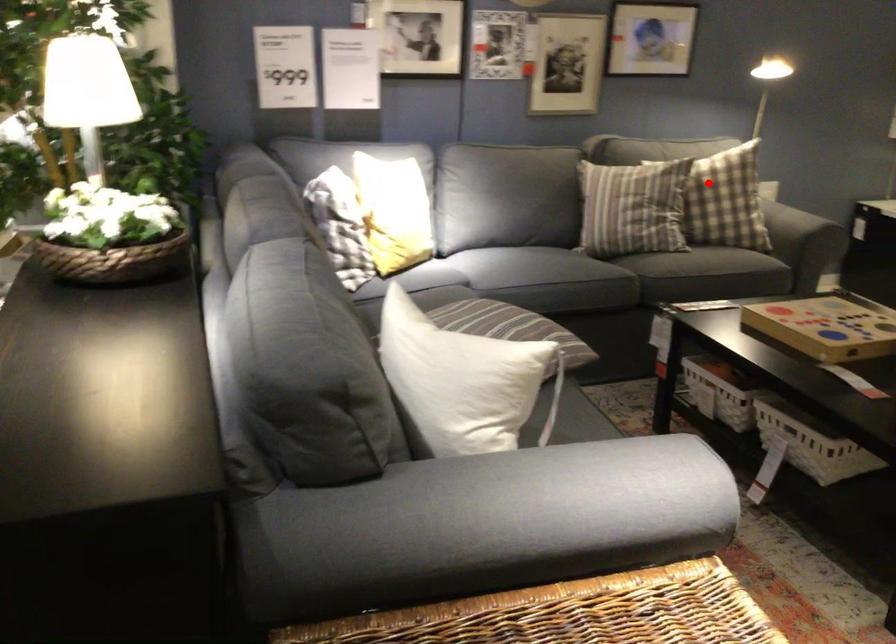
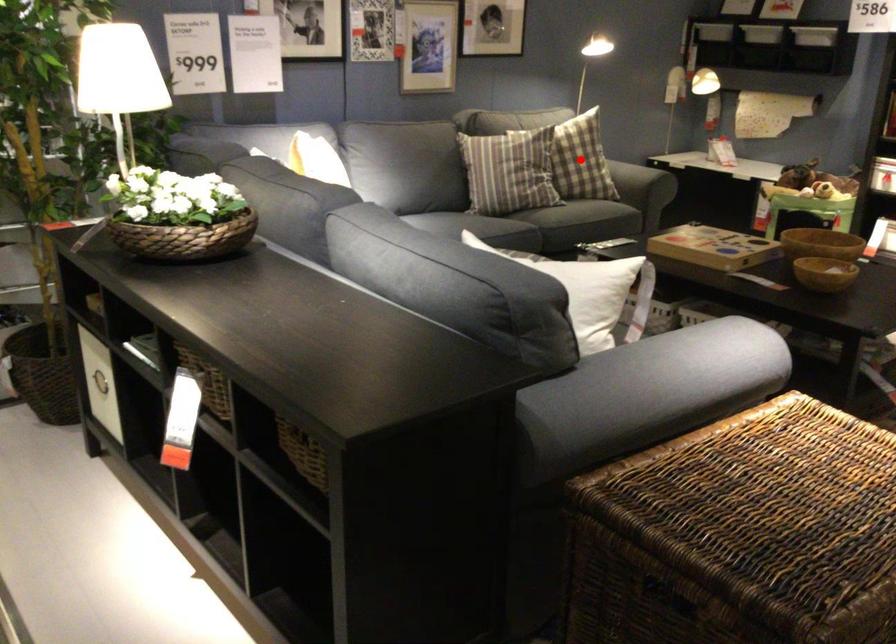
I am providing you with two images of the same scene from different viewpoints. A red point is marked on the first image and another point is marked on the second image. Is the red point in image1 aligned with the point shown in image2?

Yes